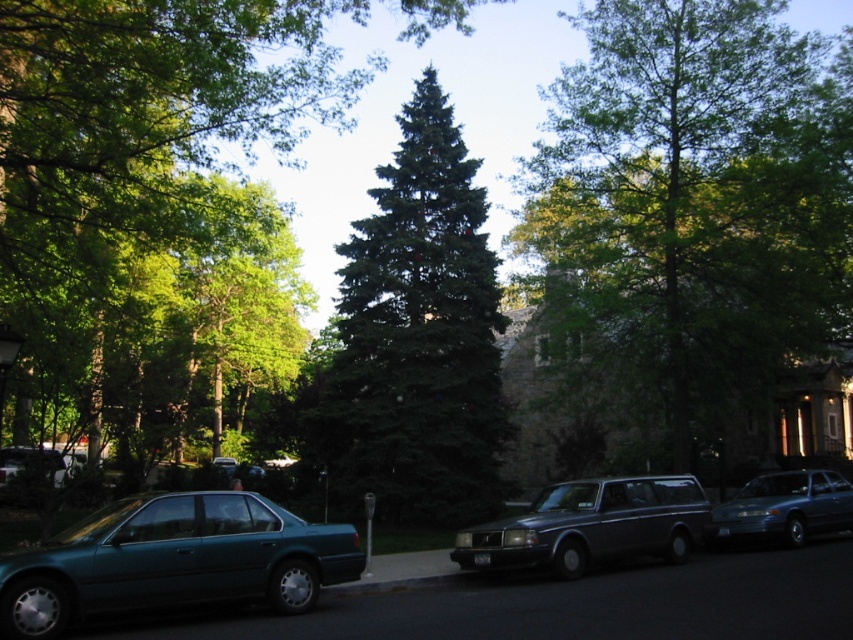
Question: Does green needle-like at center have a lesser width compared to metallic gray station wagon at center?

Choices:
 (A) no
 (B) yes

Answer: (A)

Question: Is the position of metallic gray station wagon at center more distant than that of metallic blue sedan at center?

Choices:
 (A) no
 (B) yes

Answer: (A)

Question: Can you confirm if green leafy tree at center is positioned below metallic teal sedan at lower left?

Choices:
 (A) yes
 (B) no

Answer: (B)

Question: Which of the following is the closest to the observer?

Choices:
 (A) (825, 243)
 (B) (25, 451)

Answer: (A)

Question: Which of these objects is positioned closest to the metallic teal sedan at lower left?

Choices:
 (A) green needle-like at center
 (B) green leafy tree at center

Answer: (A)

Question: Which object appears closest to the camera in this image?

Choices:
 (A) teal metallic sedan at lower left
 (B) green textured tree at center

Answer: (A)